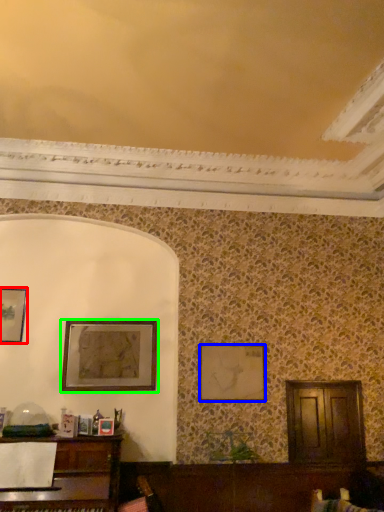
Question: Which object is positioned closest to picture frame (highlighted by a red box)? Select from picture frame (highlighted by a blue box) and picture frame (highlighted by a green box).

Choices:
 (A) picture frame
 (B) picture frame

Answer: (B)